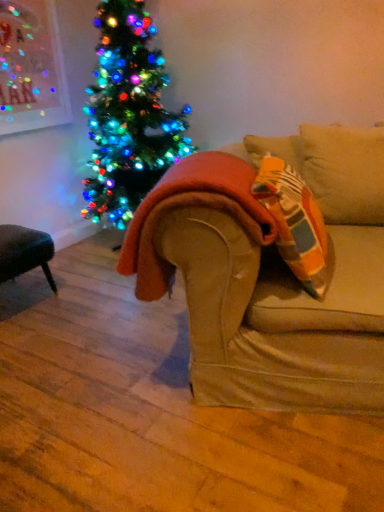
In order to face orange fabric pillow at right, should I rotate leftwards or rightwards?

Rotate right and turn 13.581 degrees.

Describe the element at coordinates (295, 223) in the screenshot. I see `orange fabric pillow at right` at that location.

Image resolution: width=384 pixels, height=512 pixels. Identify the location of orange fabric pillow at right. (295, 223).

Locate an element on the screen. This screenshot has height=512, width=384. orange fuzzy blanket at center is located at coordinates (191, 205).

The width and height of the screenshot is (384, 512). Describe the element at coordinates (191, 205) in the screenshot. I see `orange fuzzy blanket at center` at that location.

Locate an element on the screen. orange fabric pillow at right is located at coordinates (295, 223).

Is orange fabric pillow at right to the right of orange fuzzy blanket at center from the viewer's perspective?

Indeed, orange fabric pillow at right is positioned on the right side of orange fuzzy blanket at center.

Is orange fabric pillow at right in front of or behind orange fuzzy blanket at center in the image?

Clearly, orange fabric pillow at right is in front of orange fuzzy blanket at center.

Between point (273, 181) and point (183, 192), which one is positioned behind?

Positioned behind is point (273, 181).

Looking at this image, from the image's perspective, is orange fabric pillow at right located above orange fuzzy blanket at center?

Yes.

In the scene shown: From a real-world perspective, is orange fabric pillow at right positioned above or below orange fuzzy blanket at center?

Clearly, from a real-world perspective, orange fabric pillow at right is above orange fuzzy blanket at center.

Does orange fabric pillow at right have a greater width compared to orange fuzzy blanket at center?

No, orange fabric pillow at right is not wider than orange fuzzy blanket at center.

In the scene shown: Which of these two, orange fabric pillow at right or orange fuzzy blanket at center, stands taller?

orange fabric pillow at right.

Based on their sizes in the image, would you say orange fabric pillow at right is bigger or smaller than orange fuzzy blanket at center?

Clearly, orange fabric pillow at right is smaller in size than orange fuzzy blanket at center.

Is orange fabric pillow at right not inside orange fuzzy blanket at center?

Yes, orange fabric pillow at right is outside of orange fuzzy blanket at center.

Is orange fabric pillow at right touching orange fuzzy blanket at center?

No, orange fabric pillow at right is not in contact with orange fuzzy blanket at center.

Does orange fabric pillow at right turn towards orange fuzzy blanket at center?

Yes, orange fabric pillow at right faces towards orange fuzzy blanket at center.

From the picture: How different are the orientations of orange fabric pillow at right and orange fuzzy blanket at center in degrees?

80.3 degrees.

Where is `throw pillow lying on the right of orange fuzzy blanket at center`? This screenshot has height=512, width=384. throw pillow lying on the right of orange fuzzy blanket at center is located at coordinates (295, 223).

Based on the photo, between orange fuzzy blanket at center and orange fabric pillow at right, which one appears on the right side from the viewer's perspective?

orange fabric pillow at right is more to the right.

Relative to orange fabric pillow at right, is orange fuzzy blanket at center in front or behind?

Clearly, orange fuzzy blanket at center is behind orange fabric pillow at right.

Considering the points (147, 290) and (319, 242), which point is behind, point (147, 290) or point (319, 242)?

Point (147, 290)

Based on the photo, from the image's perspective, which one is positioned higher, orange fuzzy blanket at center or orange fabric pillow at right?

orange fabric pillow at right is shown above in the image.

From a real-world perspective, who is located higher, orange fuzzy blanket at center or orange fabric pillow at right?

orange fabric pillow at right.

Is orange fuzzy blanket at center thinner than orange fabric pillow at right?

No.

Is orange fuzzy blanket at center taller or shorter than orange fabric pillow at right?

Clearly, orange fuzzy blanket at center is shorter compared to orange fabric pillow at right.

Based on their sizes in the image, would you say orange fuzzy blanket at center is bigger or smaller than orange fabric pillow at right?

Considering their sizes, orange fuzzy blanket at center takes up more space than orange fabric pillow at right.

Is orange fuzzy blanket at center inside the boundaries of orange fabric pillow at right, or outside?

orange fuzzy blanket at center is not inside orange fabric pillow at right, it's outside.

Is orange fuzzy blanket at center beside orange fabric pillow at right?

No, orange fuzzy blanket at center is not touching orange fabric pillow at right.

Is orange fabric pillow at right at the back of orange fuzzy blanket at center?

No, orange fuzzy blanket at center is not facing the opposite direction of orange fabric pillow at right.

What's the angular difference between orange fuzzy blanket at center and orange fabric pillow at right's facing directions?

80.3 degrees.

Find the location of `throw pillow above the orange fuzzy blanket at center (from a real-world perspective)`. throw pillow above the orange fuzzy blanket at center (from a real-world perspective) is located at coordinates (295, 223).

Where is `throw pillow above the orange fuzzy blanket at center (from a real-world perspective)`? This screenshot has width=384, height=512. throw pillow above the orange fuzzy blanket at center (from a real-world perspective) is located at coordinates (295, 223).

Where is `throw pillow in front of the orange fuzzy blanket at center`? The width and height of the screenshot is (384, 512). throw pillow in front of the orange fuzzy blanket at center is located at coordinates (295, 223).